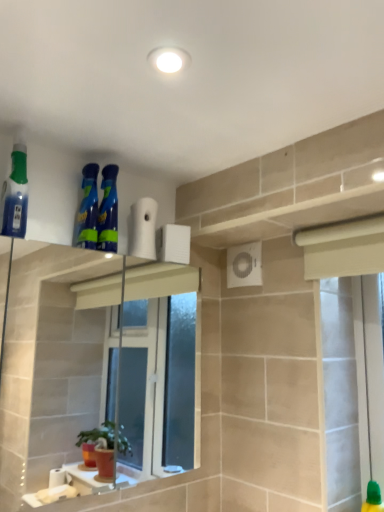
Question: Which direction should I rotate to face blue glossy spray bottles at upper center, the second cleaning product positioned from the left, — up or down?

Choices:
 (A) up
 (B) down

Answer: (A)

Question: Does blue glossy spray bottles at upper center, the second cleaning product viewed from the right, come in front of white matte toilet paper at upper center?

Choices:
 (A) no
 (B) yes

Answer: (B)

Question: Does blue glossy spray bottles at upper center, the second cleaning product positioned from the left, have a lesser height compared to white matte toilet paper at upper center?

Choices:
 (A) yes
 (B) no

Answer: (B)

Question: Is blue glossy spray bottles at upper center, the second cleaning product viewed from the right, thinner than white matte toilet paper at upper center?

Choices:
 (A) yes
 (B) no

Answer: (B)

Question: Is the surface of blue glossy spray bottles at upper center, the second cleaning product positioned from the left, in direct contact with white matte toilet paper at upper center?

Choices:
 (A) no
 (B) yes

Answer: (A)

Question: Is white matte toilet paper at upper center located within blue glossy spray bottles at upper center, the second cleaning product positioned from the left?

Choices:
 (A) yes
 (B) no

Answer: (B)

Question: Is blue glossy spray bottles at upper center, the second cleaning product viewed from the right, positioned with its back to white matte toilet paper at upper center?

Choices:
 (A) yes
 (B) no

Answer: (B)

Question: Is blue glossy spray bottles at upper center, acting as the 3th cleaning product starting from the left, facing towards blue glossy spray bottles at upper center, the second cleaning product viewed from the right?

Choices:
 (A) yes
 (B) no

Answer: (B)

Question: Is blue glossy spray bottles at upper center, acting as the 3th cleaning product starting from the left, oriented away from blue glossy spray bottles at upper center, the second cleaning product positioned from the left?

Choices:
 (A) no
 (B) yes

Answer: (A)

Question: Considering the relative sizes of blue glossy spray bottles at upper center, which appears as the 1th cleaning product when viewed from the right, and blue glossy spray bottles at upper center, the second cleaning product viewed from the right, in the image provided, is blue glossy spray bottles at upper center, which appears as the 1th cleaning product when viewed from the right, bigger than blue glossy spray bottles at upper center, the second cleaning product viewed from the right,?

Choices:
 (A) yes
 (B) no

Answer: (A)

Question: Considering the relative positions of blue glossy spray bottles at upper center, which appears as the 1th cleaning product when viewed from the right, and blue glossy spray bottles at upper center, the second cleaning product positioned from the left, in the image provided, is blue glossy spray bottles at upper center, which appears as the 1th cleaning product when viewed from the right, to the left of blue glossy spray bottles at upper center, the second cleaning product positioned from the left, from the viewer's perspective?

Choices:
 (A) no
 (B) yes

Answer: (A)

Question: From the image's perspective, does blue glossy spray bottles at upper center, which appears as the 1th cleaning product when viewed from the right, appear lower than blue glossy spray bottles at upper center, the second cleaning product viewed from the right?

Choices:
 (A) no
 (B) yes

Answer: (B)

Question: Is blue glossy spray bottles at upper center, which appears as the 1th cleaning product when viewed from the right, behind blue glossy spray bottles at upper center, the second cleaning product viewed from the right?

Choices:
 (A) no
 (B) yes

Answer: (B)

Question: Can you confirm if translucent blue spray bottle at left, which appears as the third cleaning product when viewed from the right, is positioned to the right of white matte toilet paper at upper center?

Choices:
 (A) yes
 (B) no

Answer: (B)